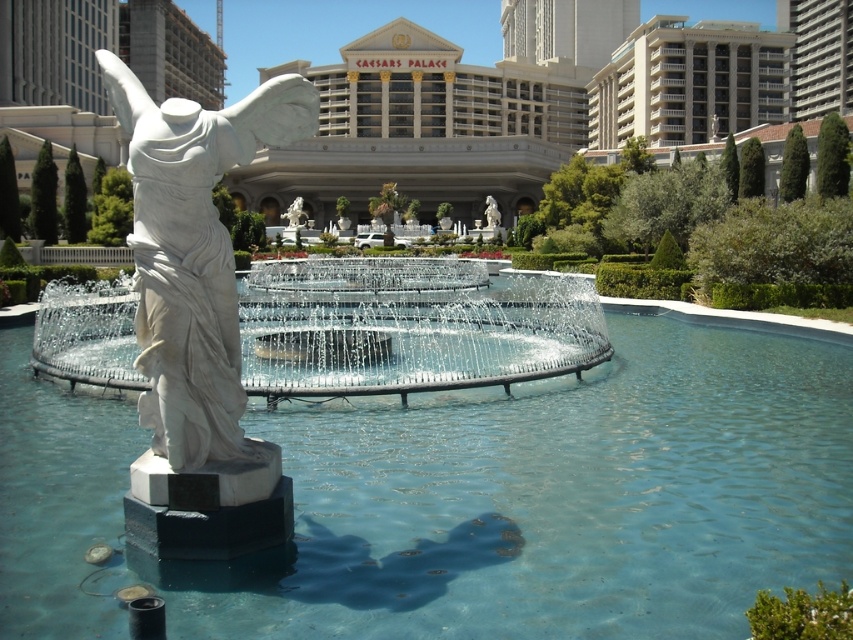
Question: Which of the following is the closest to the observer?

Choices:
 (A) white marble statue at center
 (B) clear glass pool at center
 (C) white marble fountain at center

Answer: (B)

Question: Does white marble fountain at center have a smaller size compared to white marble statue at center?

Choices:
 (A) yes
 (B) no

Answer: (B)

Question: Which point is farther to the camera?

Choices:
 (A) white marble fountain at center
 (B) clear glass pool at center

Answer: (A)

Question: Does clear glass pool at center have a smaller size compared to white marble statue at center?

Choices:
 (A) no
 (B) yes

Answer: (A)

Question: Does white marble fountain at center appear under white marble statue at center?

Choices:
 (A) yes
 (B) no

Answer: (B)

Question: Among these objects, which one is farthest from the camera?

Choices:
 (A) clear glass pool at center
 (B) white marble fountain at center

Answer: (B)